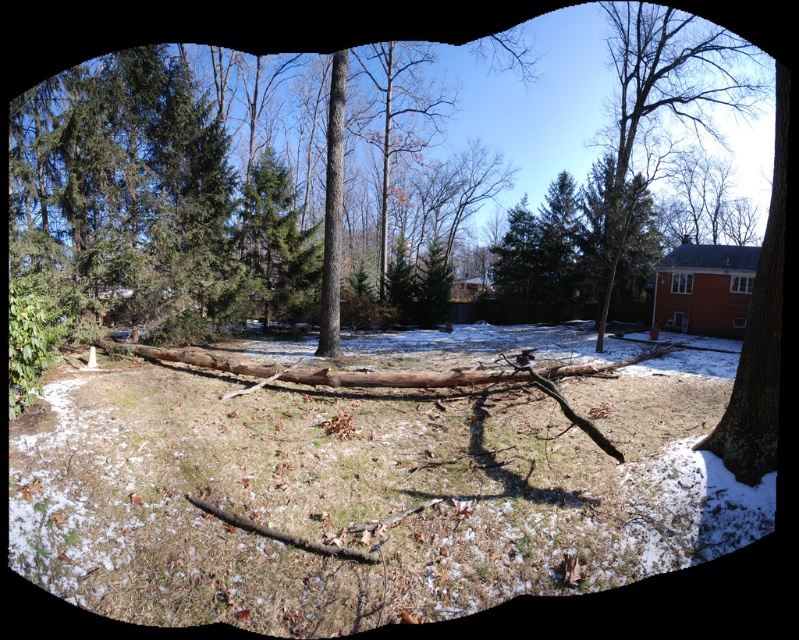
Is brown rough tree at upper right further to camera compared to brown rough bark tree trunk at right?

Yes, brown rough tree at upper right is further from the viewer.

Can you confirm if brown rough tree at upper right is positioned above brown rough bark tree trunk at right?

Yes, brown rough tree at upper right is above brown rough bark tree trunk at right.

Between point (630, 90) and point (773, 362), which one is positioned behind?

Point (630, 90)

Find the location of a particular element. This screenshot has height=640, width=799. brown rough tree at upper right is located at coordinates (662, 93).

Is brown rough bark tree trunk at right shorter than smooth brown tree trunk at center?

No.

Describe the element at coordinates (758, 333) in the screenshot. The width and height of the screenshot is (799, 640). I see `brown rough bark tree trunk at right` at that location.

Between point (742, 358) and point (332, 136), which one is positioned behind?

The point (332, 136) is more distant.

Where is `brown rough bark tree trunk at right`? brown rough bark tree trunk at right is located at coordinates (758, 333).

Which is below, brown rough wood log at center or brown rough tree at upper right?

brown rough wood log at center

Can you confirm if brown rough wood log at center is taller than brown rough tree at upper right?

No.

You are a GUI agent. You are given a task and a screenshot of the screen. Output one action in this format:
    pyautogui.click(x=<x>, y=<y>)
    Task: Click on the brown rough wood log at center
    This screenshot has width=799, height=640.
    Given the screenshot: What is the action you would take?
    pyautogui.click(x=368, y=492)